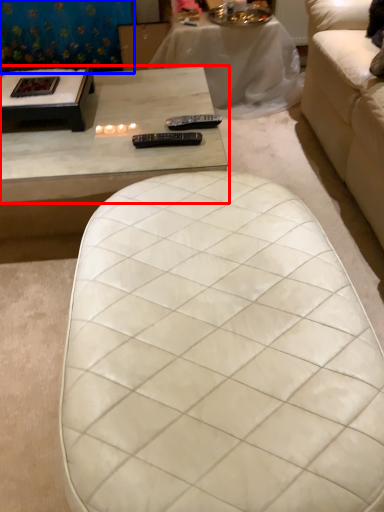
Question: Among these objects, which one is farthest to the camera, coffee table (highlighted by a red box) or curtain (highlighted by a blue box)?

Choices:
 (A) coffee table
 (B) curtain

Answer: (B)